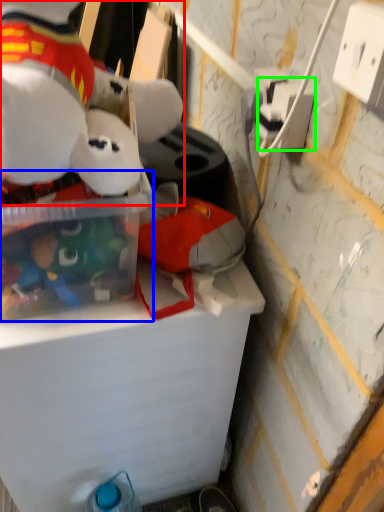
Question: Which object is the farthest from toy (highlighted by a red box)? Choose among these: storage box (highlighted by a blue box) or power outlet (highlighted by a green box).

Choices:
 (A) storage box
 (B) power outlet

Answer: (B)